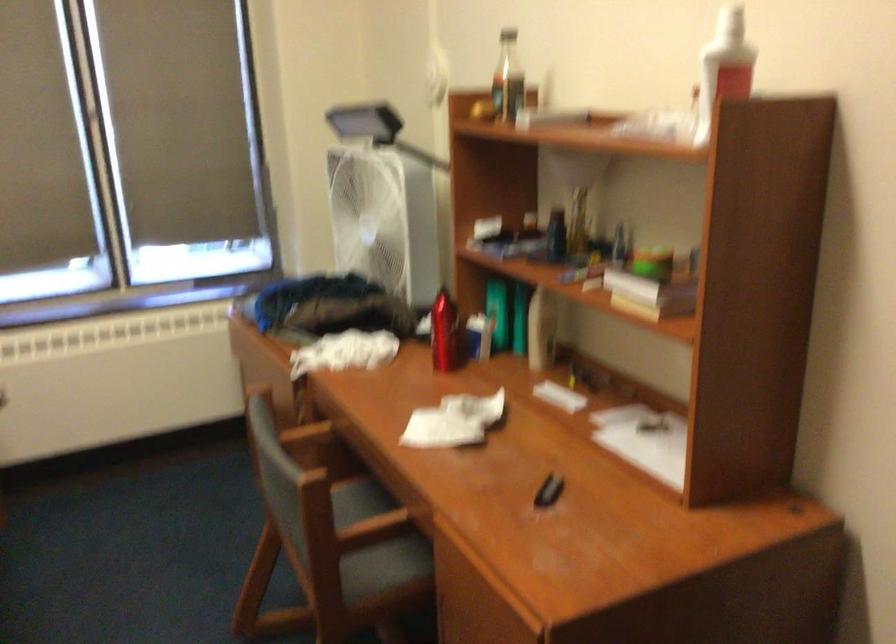
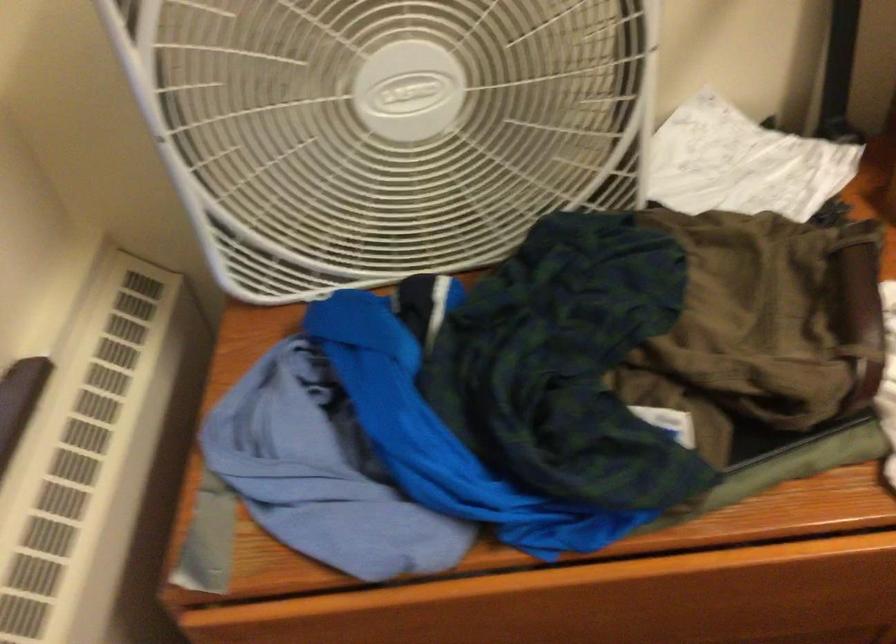
In the second image, find the point that corresponds to [362,234] in the first image.

(385, 127)